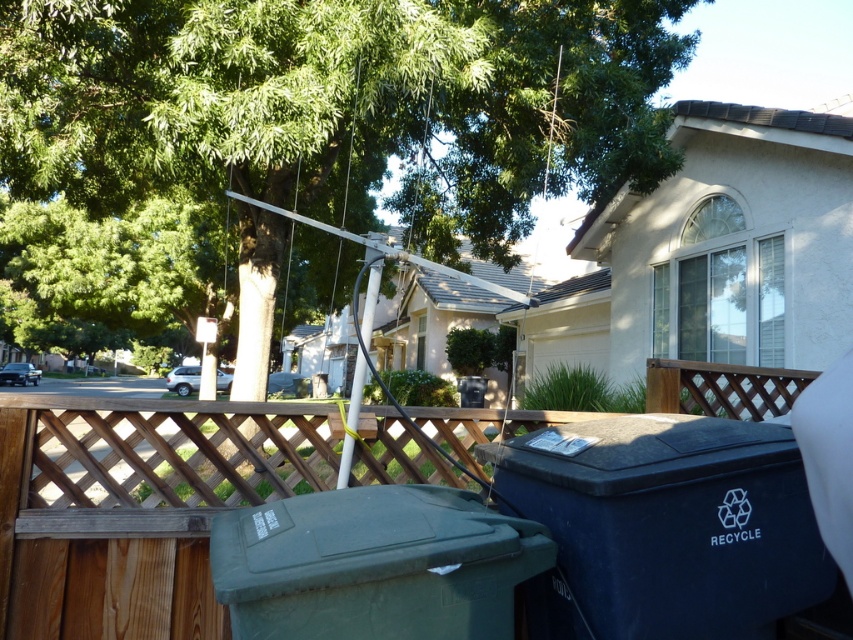
Question: Estimate the real-world distances between objects in this image. Which object is farther from the green plastic recycling bin at lower center?

Choices:
 (A) matte black recycling bin at lower right
 (B) green leafy tree at upper left

Answer: (B)

Question: Among these objects, which one is farthest from the camera?

Choices:
 (A) green plastic recycling bin at lower center
 (B) matte black recycling bin at lower right
 (C) green leafy tree at upper left

Answer: (C)

Question: Does green leafy tree at upper left come behind green plastic recycling bin at lower center?

Choices:
 (A) no
 (B) yes

Answer: (B)

Question: Can you confirm if green leafy tree at upper left is smaller than matte black recycling bin at lower right?

Choices:
 (A) no
 (B) yes

Answer: (A)

Question: Can you confirm if green leafy tree at upper left is smaller than matte black recycling bin at lower right?

Choices:
 (A) yes
 (B) no

Answer: (B)

Question: Which object appears closest to the camera in this image?

Choices:
 (A) matte black recycling bin at lower right
 (B) green plastic recycling bin at lower center

Answer: (B)